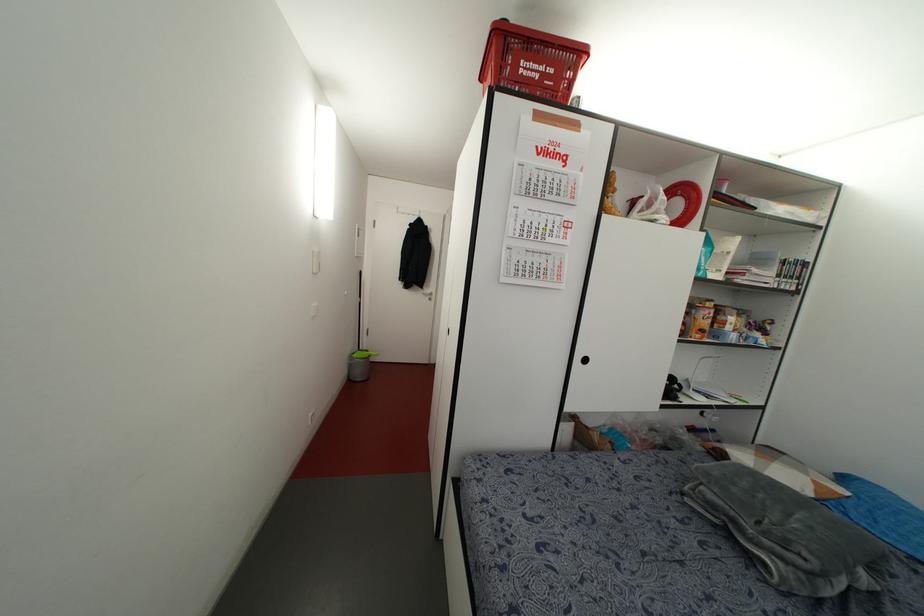
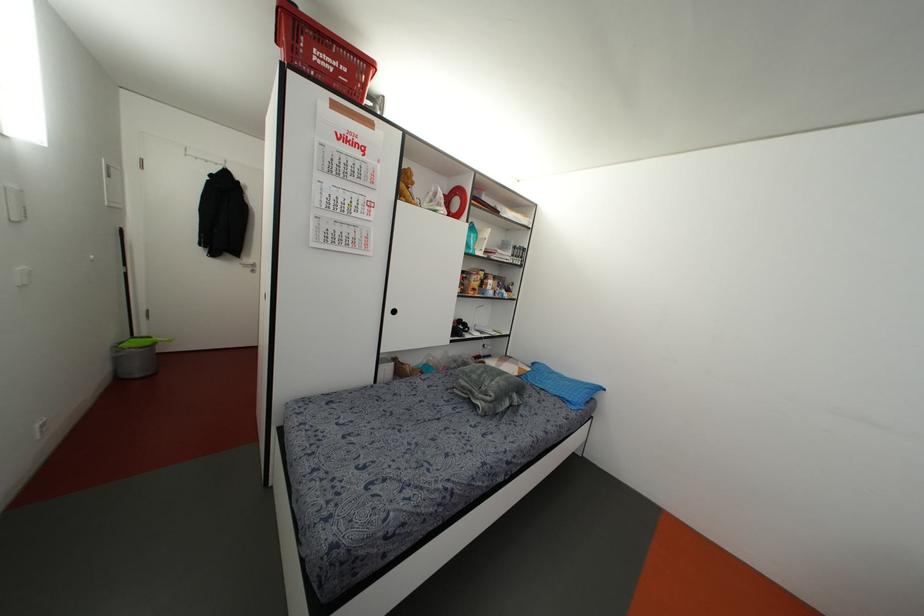
In the second image, find the point that corresponds to point (585, 360) in the first image.

(394, 310)